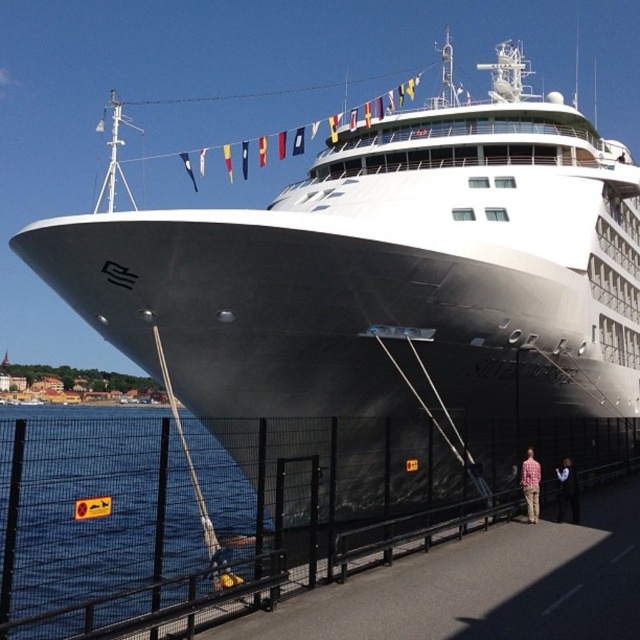
Question: Can you confirm if blue water at lower left is wider than black suit at lower right?

Choices:
 (A) no
 (B) yes

Answer: (B)

Question: Which point appears closest to the camera in this image?

Choices:
 (A) (96, 474)
 (B) (564, 500)

Answer: (A)

Question: Is black suit at lower right wider than plaid shirt at lower right?

Choices:
 (A) no
 (B) yes

Answer: (B)

Question: Which of the following is the farthest from the observer?

Choices:
 (A) (115, 536)
 (B) (525, 493)
 (C) (563, 506)

Answer: (C)

Question: Which of the following is the farthest from the observer?

Choices:
 (A) (106, 472)
 (B) (572, 486)
 (C) (529, 451)

Answer: (C)

Question: Does black suit at lower right appear over plaid shirt at lower right?

Choices:
 (A) yes
 (B) no

Answer: (B)